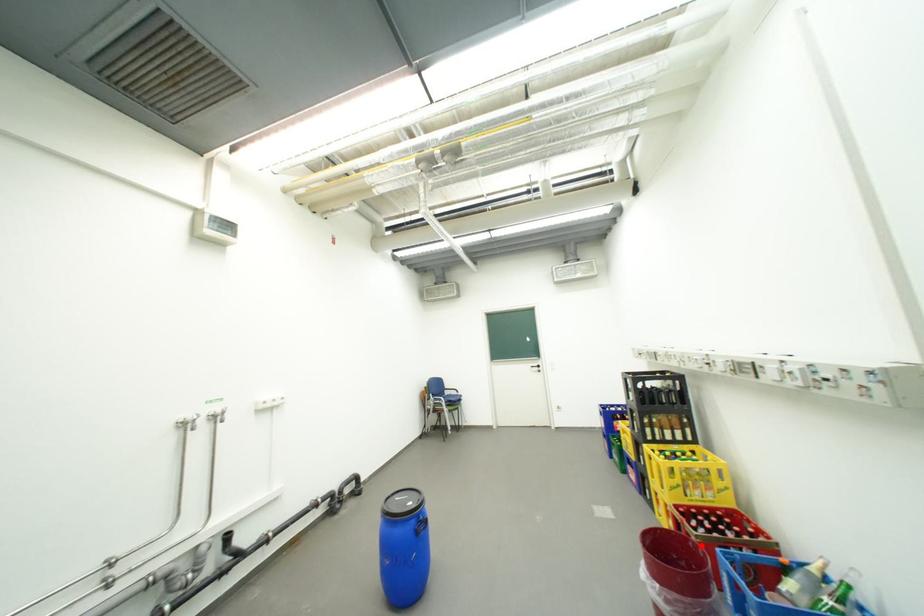
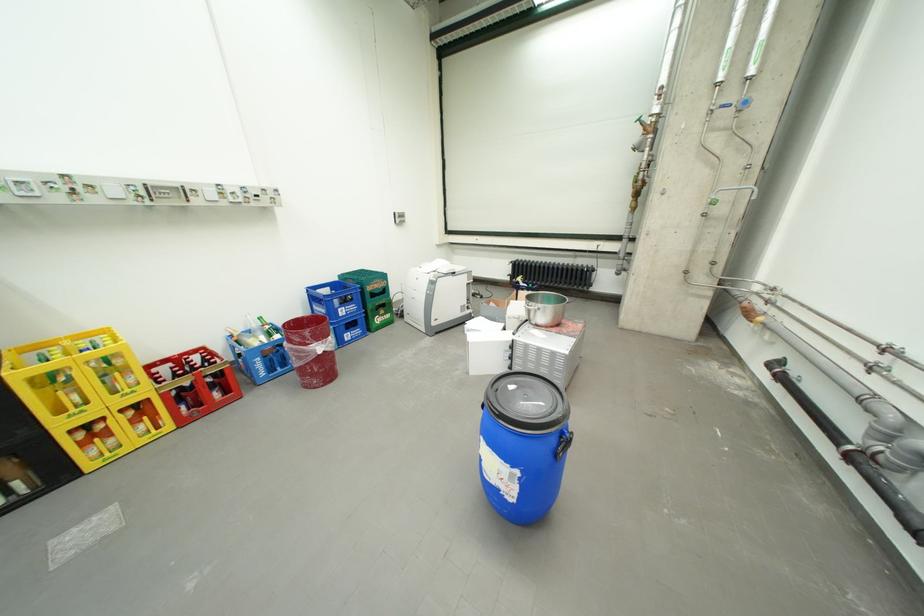
In the second image, find the point that corresponds to the highlighted location in the first image.

(297, 328)